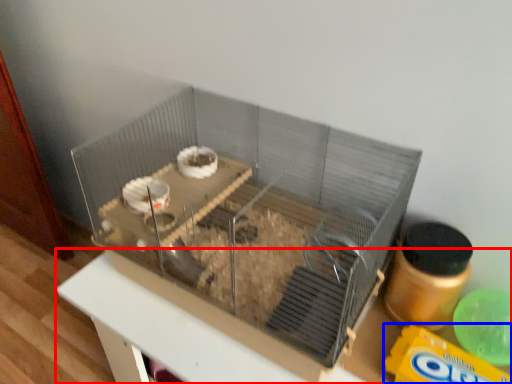
Question: Among these objects, which one is nearest to the camera, table (highlighted by a red box) or cereal (highlighted by a blue box)?

Choices:
 (A) table
 (B) cereal

Answer: (A)